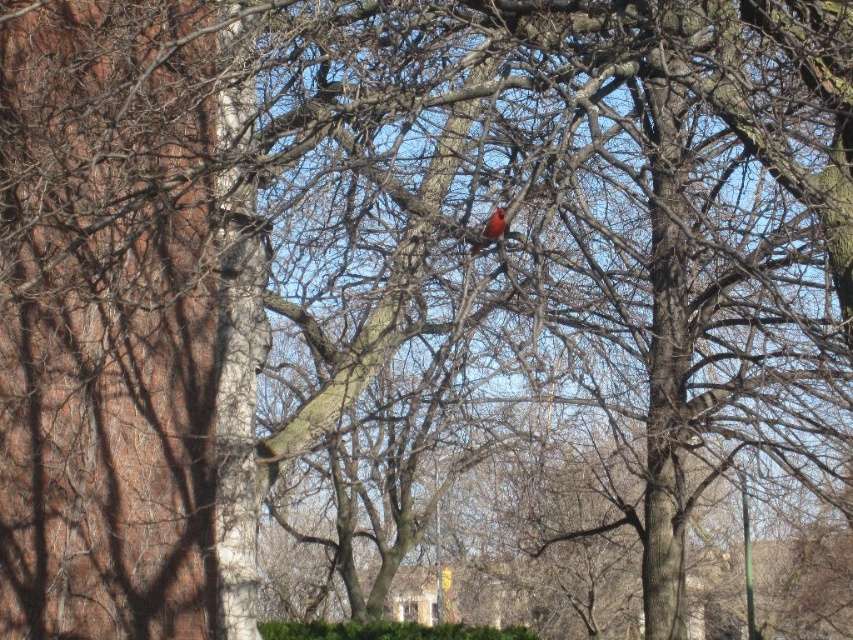
Which is above, green leafy hedge at lower center or bright red feathers at center?

bright red feathers at center is higher up.

Does green leafy hedge at lower center have a lesser width compared to bright red feathers at center?

In fact, green leafy hedge at lower center might be wider than bright red feathers at center.

Which is in front, point (276, 627) or point (469, 248)?

Positioned in front is point (469, 248).

I want to click on green leafy hedge at lower center, so click(x=387, y=630).